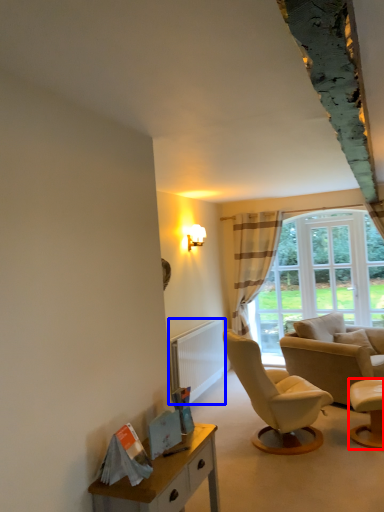
Question: Which object is closer to the camera taking this photo, chair (highlighted by a red box) or radiator (highlighted by a blue box)?

Choices:
 (A) chair
 (B) radiator

Answer: (A)